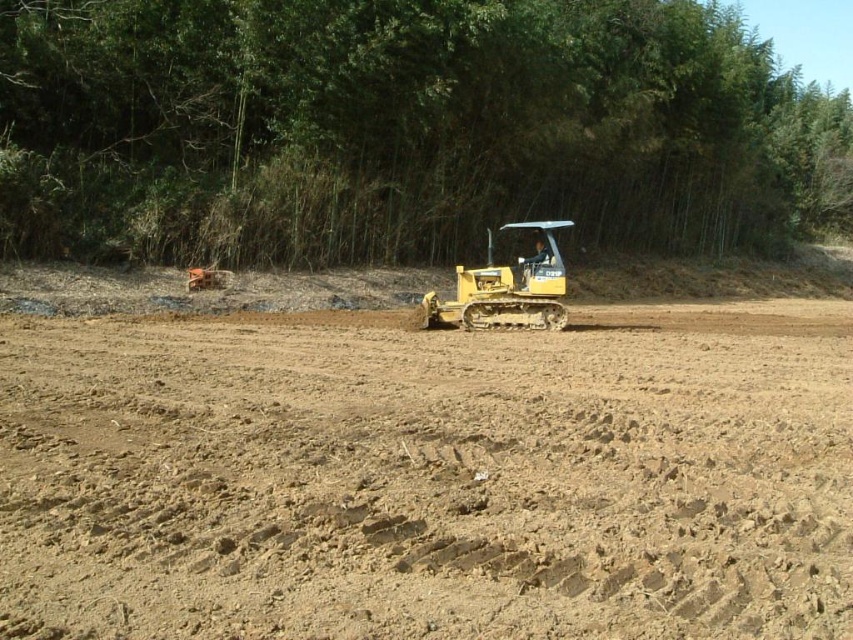
In the scene shown: You are a surveyor using a camera to map the construction site. You have two points marked on your camera screen at coordinates point (198, 493) and point (514, 304). Which point is closer to your camera lens?

Point (198, 493) is closer to the camera lens than point (514, 304).

You are a construction worker who needs to place a 20 meter long safety barrier between the brown sandy dirt at center and the green bamboo at upper center. Can the barrier fit in the space between them?

The distance between the brown sandy dirt at center and the green bamboo at upper center is 20.32 meters, so the 20 meter long safety barrier can fit in the space between them as it is slightly shorter than the distance available.